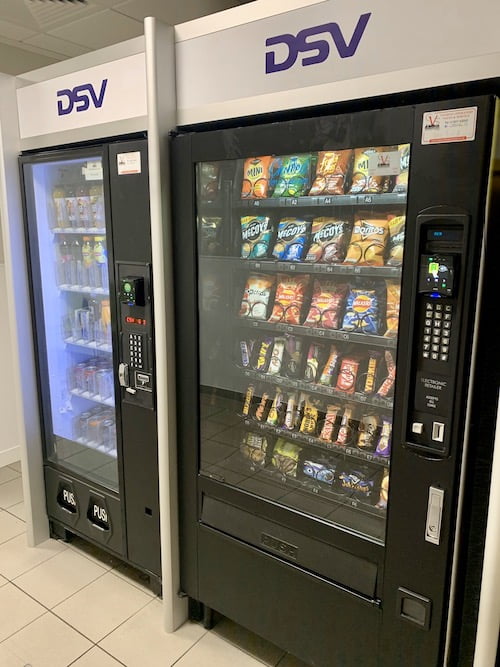
Where is `wall`? wall is located at coordinates (5, 376).